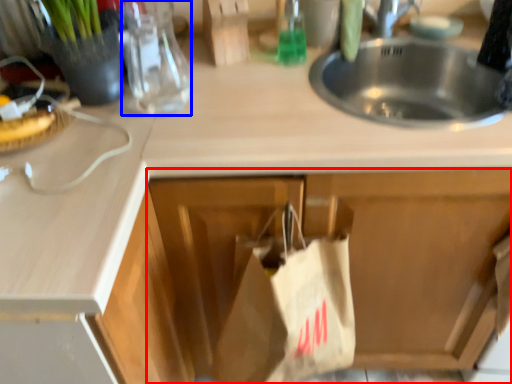
Question: Among these objects, which one is nearest to the camera, cabinetry (highlighted by a red box) or bottle (highlighted by a blue box)?

Choices:
 (A) cabinetry
 (B) bottle

Answer: (A)